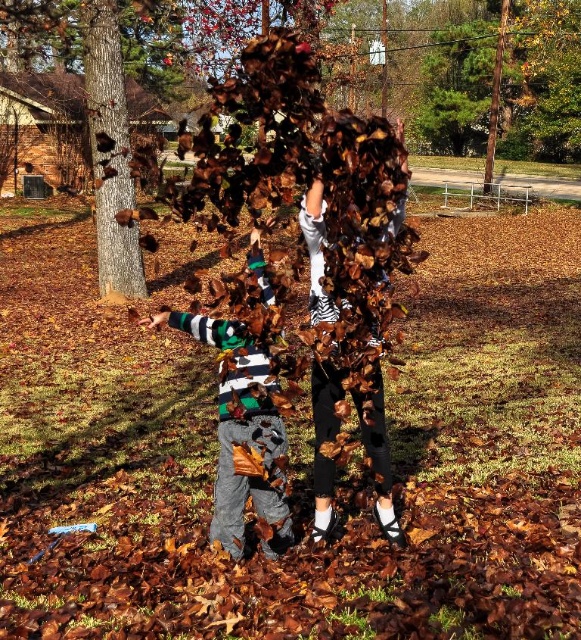
You are standing in the autumn backyard scene. You see the striped cotton shirt at left and the smooth brown bark at left. Which object is closer to the ground?

The striped cotton shirt at left is closer to the ground since it is shorter than the smooth brown bark at left.

You are standing in the autumn scene described. You need to locate the striped cotton shirt at left. Where would you look relative to the tree trunk on the left side of the frame?

The striped cotton shirt at left is located at the coordinates 0.680 on the x axis and 0.413 on the y axis, which is to the right of the tree trunk on the left side of the frame since the x coordinate is greater than 0.5.